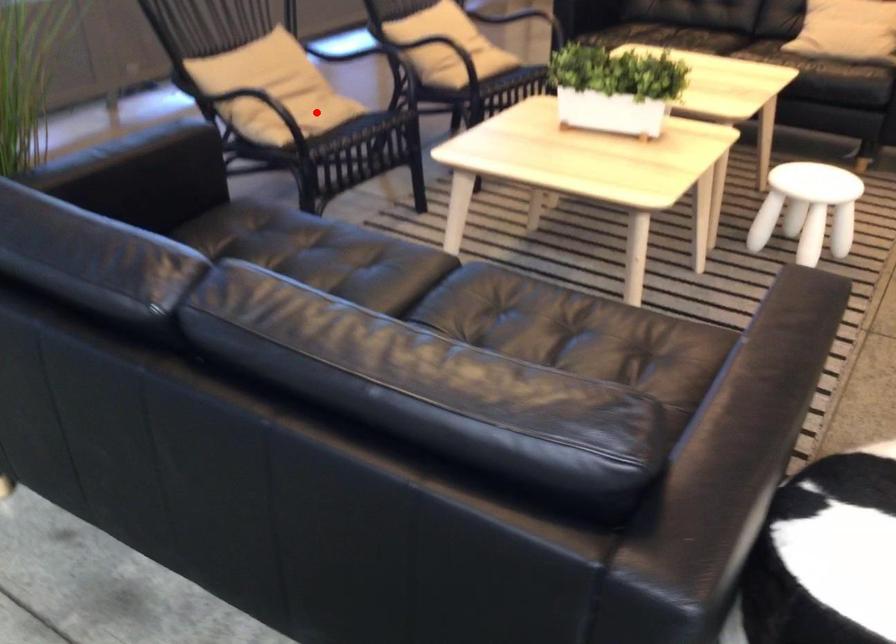
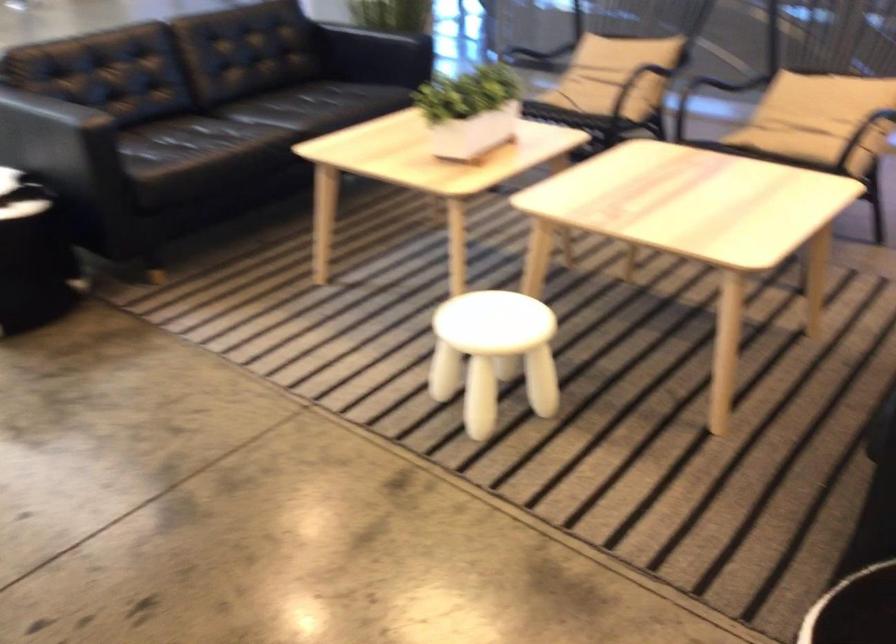
Question: I am providing you with two images of the same scene from different viewpoints. Image1 has a red point marked. In image2, the corresponding 3D location appears at what relative position? Reply with the corresponding letter.

Choices:
 (A) Closer
 (B) Farther

Answer: (B)